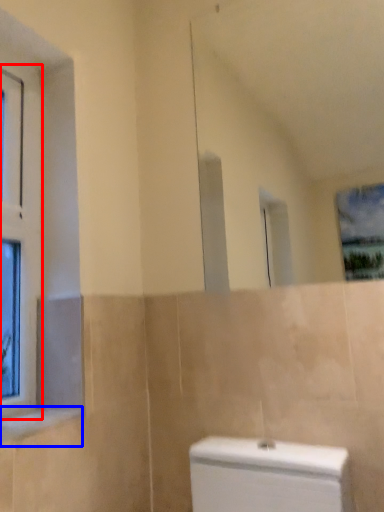
Question: Which object is further to the camera taking this photo, window (highlighted by a red box) or window sill (highlighted by a blue box)?

Choices:
 (A) window
 (B) window sill

Answer: (A)